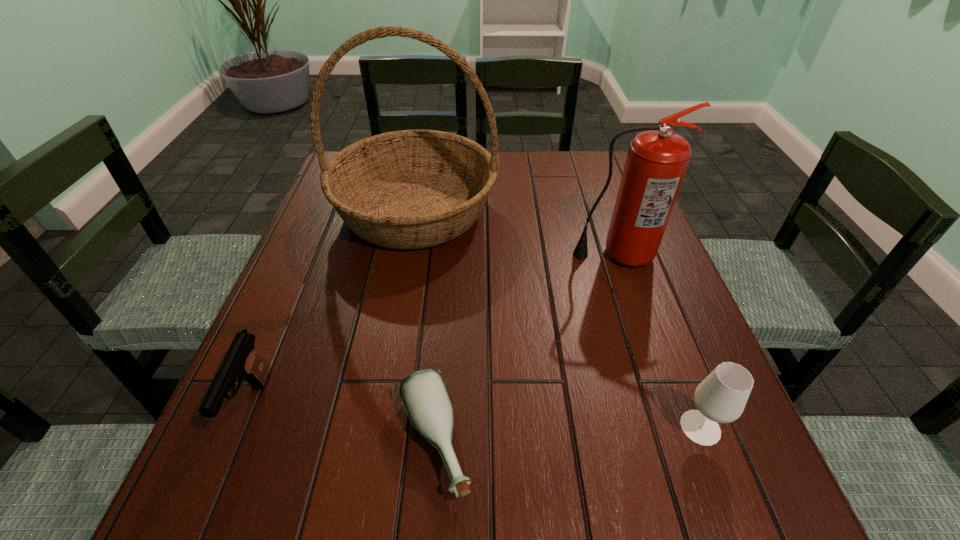
This screenshot has height=540, width=960. I want to click on basket, so click(411, 189).

You are a GUI agent. You are given a task and a screenshot of the screen. Output one action in this format:
    pyautogui.click(x=<x>, y=<y>)
    Task: Click on the fire extinguisher
    The height and width of the screenshot is (540, 960).
    Given the screenshot: What is the action you would take?
    pyautogui.click(x=657, y=160)

I want to click on glass, so point(721,397).

You are a GUI agent. You are given a task and a screenshot of the screen. Output one action in this format:
    pyautogui.click(x=<x>, y=<y>)
    Task: Click on the fourth tallest object
    This screenshot has height=540, width=960.
    Given the screenshot: What is the action you would take?
    pyautogui.click(x=242, y=360)

The height and width of the screenshot is (540, 960). Identify the location of bottle. (424, 395).

Identify the location of vacant space located 0.240m on the right of the tallest object. (588, 210).

Image resolution: width=960 pixels, height=540 pixels. Identify the location of free space located on the instruction side of the fourth shortest object. (673, 422).

This screenshot has height=540, width=960. I want to click on free space located on the back of the glass, so click(x=662, y=327).

Find the location of a particular element. The width and height of the screenshot is (960, 540). vacant space located 0.090m at the barrel of the second shortest object is located at coordinates (208, 508).

You are a GUI agent. You are given a task and a screenshot of the screen. Output one action in this format:
    pyautogui.click(x=<x>, y=<y>)
    Task: Click on the vacant space located on the left of the shortest object
    
    Given the screenshot: What is the action you would take?
    pyautogui.click(x=216, y=442)